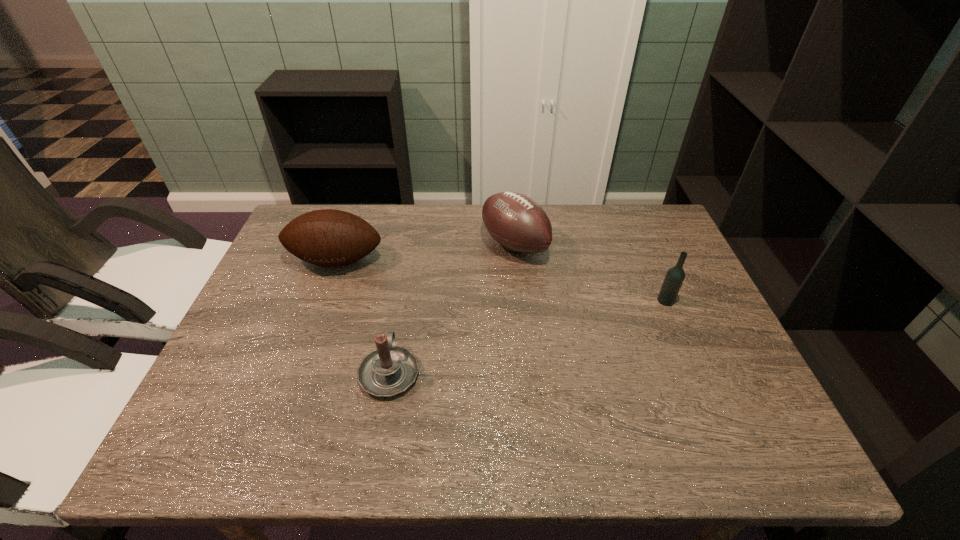
Identify the location of empty space that is in between the rightmost object and the nearest object. click(x=528, y=336).

Locate an element on the screen. The image size is (960, 540). free area in between the left football and the right football is located at coordinates (425, 253).

You are a GUI agent. You are given a task and a screenshot of the screen. Output one action in this format:
    pyautogui.click(x=<x>, y=<y>)
    Task: Click on the free spot between the third object from left to right and the third farthest object
    This screenshot has width=960, height=540.
    Given the screenshot: What is the action you would take?
    pyautogui.click(x=590, y=273)

Identify the location of free space between the third object from left to right and the third object from right to left. The image size is (960, 540). (452, 308).

Where is `vacant area that lies between the right football and the third object from right to left`? This screenshot has height=540, width=960. vacant area that lies between the right football and the third object from right to left is located at coordinates (452, 308).

What are the coordinates of `vacant area that lies between the leftmost object and the vodka` in the screenshot? It's located at (501, 280).

Identify the location of empty location between the shortest object and the third farthest object. The width and height of the screenshot is (960, 540). (528, 336).

Locate an element on the screen. vacant space in between the third farthest object and the left football is located at coordinates (501, 280).

Where is `free space that is in between the vodka and the shortest object`? The width and height of the screenshot is (960, 540). free space that is in between the vodka and the shortest object is located at coordinates (528, 336).

Locate an element on the screen. Image resolution: width=960 pixels, height=540 pixels. free spot between the leftmost object and the right football is located at coordinates (425, 253).